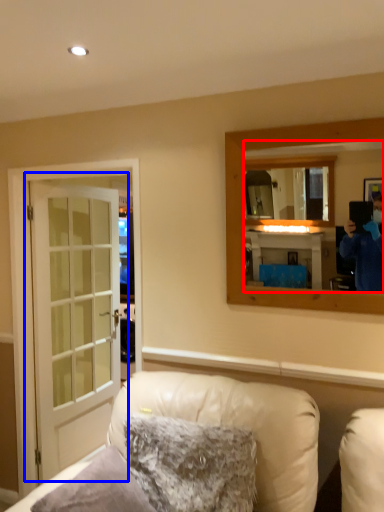
Question: Which object is closer to the camera taking this photo, mirror (highlighted by a red box) or door (highlighted by a blue box)?

Choices:
 (A) mirror
 (B) door

Answer: (A)